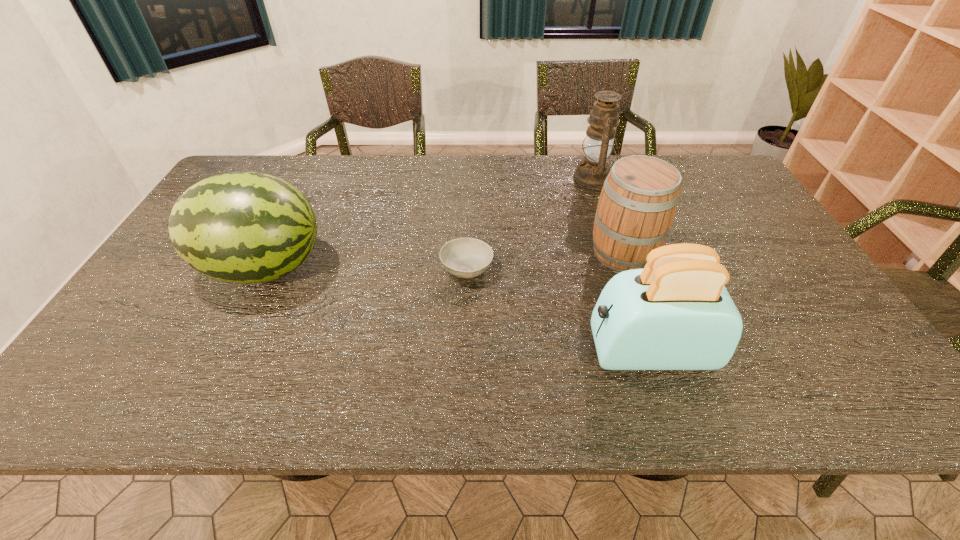
You are a GUI agent. You are given a task and a screenshot of the screen. Output one action in this format:
    pyautogui.click(x=<x>, y=<y>)
    Task: Click on the farthest object
    The width and height of the screenshot is (960, 540).
    Given the screenshot: What is the action you would take?
    pyautogui.click(x=592, y=171)

In order to click on toaster in this screenshot , I will do `click(675, 314)`.

Identify the location of watermelon. This screenshot has width=960, height=540. (241, 227).

Locate an element on the screen. The height and width of the screenshot is (540, 960). cider is located at coordinates (638, 202).

I want to click on bowl, so click(x=463, y=257).

The height and width of the screenshot is (540, 960). In order to click on the shortest object in this screenshot , I will do `click(463, 257)`.

Locate an element on the screen. The width and height of the screenshot is (960, 540). blank space located 0.080m on the right of the farthest object is located at coordinates (638, 178).

Where is `free region located 0.270m on the side of the toaster with the lever`? Image resolution: width=960 pixels, height=540 pixels. free region located 0.270m on the side of the toaster with the lever is located at coordinates (465, 351).

Locate an element on the screen. The width and height of the screenshot is (960, 540). free spot located 0.110m on the side of the toaster with the lever is located at coordinates pyautogui.click(x=538, y=351).

The image size is (960, 540). What are the coordinates of `vacant space located 0.290m on the side of the toaster with the lever` in the screenshot? It's located at (455, 351).